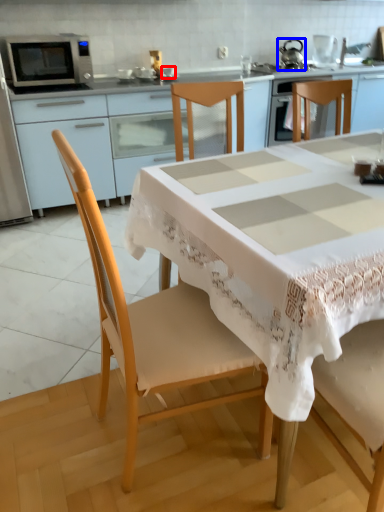
Question: Which of the following is the farthest to the observer, tableware (highlighted by a red box) or tea pot (highlighted by a blue box)?

Choices:
 (A) tableware
 (B) tea pot

Answer: (B)